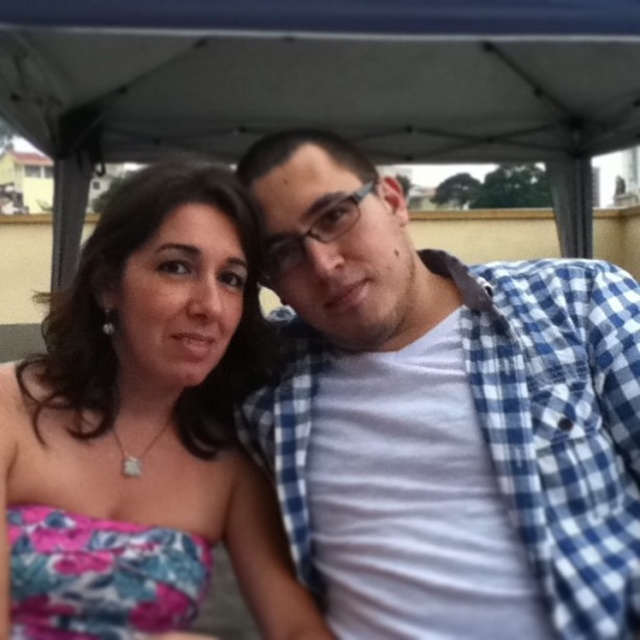
Question: Does blue checkered shirt at center appear over pink floral dress at center?

Choices:
 (A) no
 (B) yes

Answer: (B)

Question: Which of the following is the closest to the observer?

Choices:
 (A) (241, 454)
 (B) (568, 472)

Answer: (B)

Question: Is blue checkered shirt at center further to the viewer compared to pink floral dress at center?

Choices:
 (A) no
 (B) yes

Answer: (B)

Question: Does blue checkered shirt at center appear over pink floral dress at center?

Choices:
 (A) yes
 (B) no

Answer: (A)